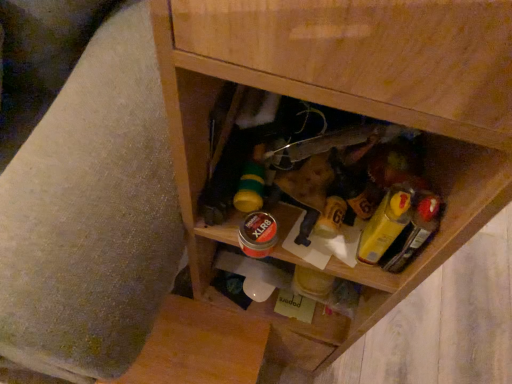
Question: Is point (116, 279) closer or farther from the camera than point (371, 251)?

Choices:
 (A) closer
 (B) farther

Answer: (A)

Question: From the image's perspective, is wooden swivel chair at lower right above or below yellow plastic mustard at center right?

Choices:
 (A) above
 (B) below

Answer: (A)

Question: Which object is the closest to the wooden cabinet at center?

Choices:
 (A) wooden swivel chair at lower right
 (B) yellow plastic mustard at center right

Answer: (B)

Question: Estimate the real-world distances between objects in this image. Which object is farther from the wooden swivel chair at lower right?

Choices:
 (A) yellow plastic mustard at center right
 (B) wooden cabinet at center

Answer: (A)